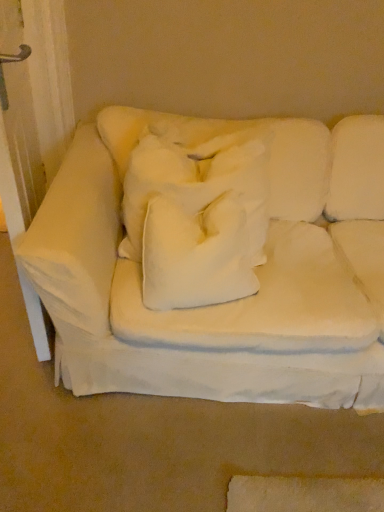
Question: From the image's perspective, does white soft cushion at center appear higher than white fabric couch at center?

Choices:
 (A) yes
 (B) no

Answer: (B)

Question: Considering the relative sizes of white soft cushion at center and white fabric couch at center in the image provided, is white soft cushion at center taller than white fabric couch at center?

Choices:
 (A) no
 (B) yes

Answer: (A)

Question: Is white fabric couch at center completely or partially inside white soft cushion at center?

Choices:
 (A) no
 (B) yes

Answer: (A)

Question: Does white soft cushion at center have a larger size compared to white fabric couch at center?

Choices:
 (A) yes
 (B) no

Answer: (B)

Question: Is white soft cushion at center wider than white fabric couch at center?

Choices:
 (A) yes
 (B) no

Answer: (B)

Question: Does white soft cushion at center turn towards white fabric couch at center?

Choices:
 (A) no
 (B) yes

Answer: (B)

Question: Is white fabric couch at center to the right of white soft cushion at center from the viewer's perspective?

Choices:
 (A) no
 (B) yes

Answer: (B)

Question: Can you confirm if white fabric couch at center is bigger than white soft cushion at center?

Choices:
 (A) yes
 (B) no

Answer: (A)

Question: Could you tell me if white fabric couch at center is turned towards white soft cushion at center?

Choices:
 (A) yes
 (B) no

Answer: (A)

Question: Is white soft cushion at center surrounded by white fabric couch at center?

Choices:
 (A) no
 (B) yes

Answer: (B)

Question: Is white fabric couch at center wider than white soft cushion at center?

Choices:
 (A) yes
 (B) no

Answer: (A)

Question: From a real-world perspective, is white fabric couch at center physically above white soft cushion at center?

Choices:
 (A) yes
 (B) no

Answer: (B)

Question: Considering the positions of white soft cushion at center and white fabric couch at center in the image, is white soft cushion at center wider or thinner than white fabric couch at center?

Choices:
 (A) thin
 (B) wide

Answer: (A)